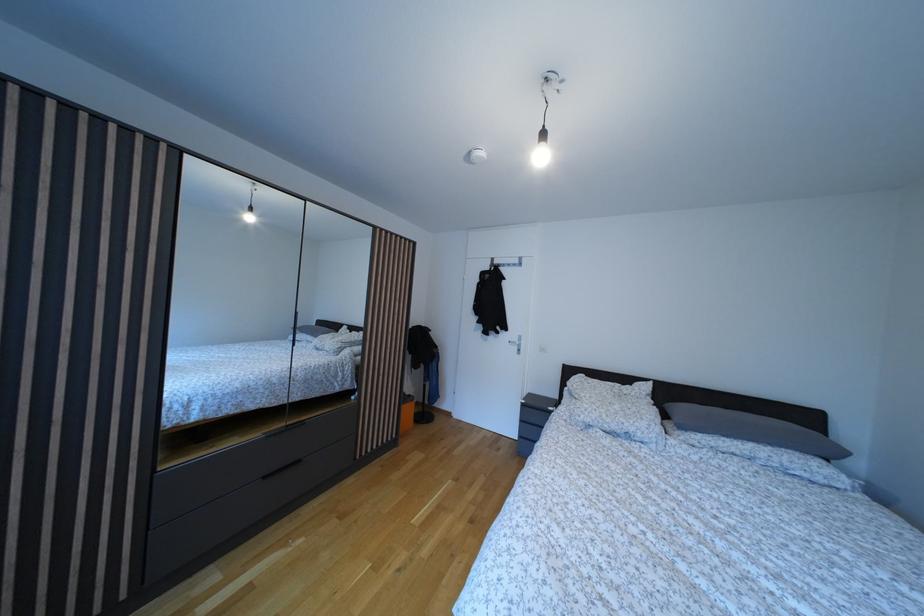
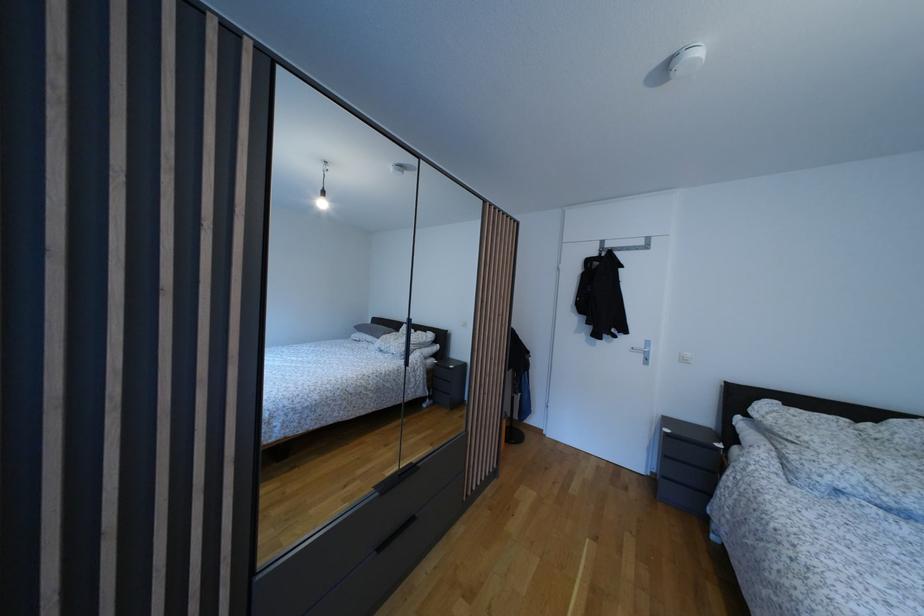
Question: The camera is either moving clockwise (left) or counter-clockwise (right) around the object. The first image is from the beginning of the video and the second image is from the end. Is the camera moving left or right when shooting the video?

Choices:
 (A) Left
 (B) Right

Answer: (B)